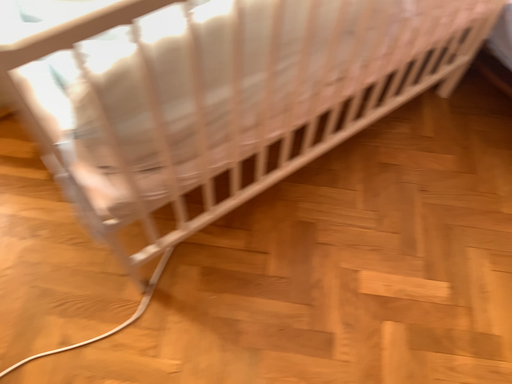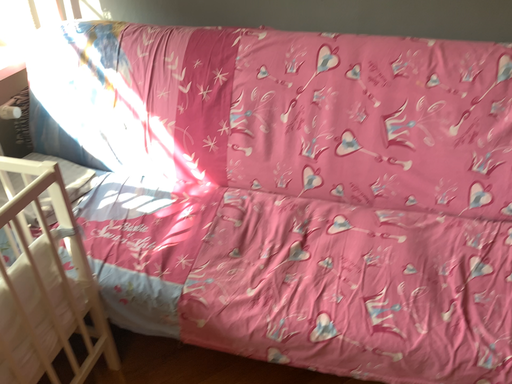
Question: Which way did the camera rotate in the video?

Choices:
 (A) rotated upward
 (B) rotated downward

Answer: (A)